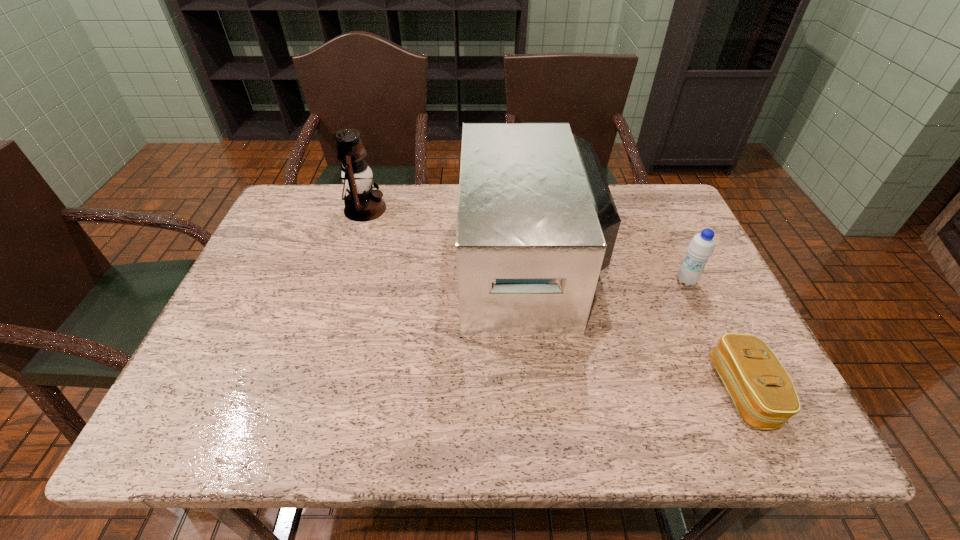
Where is `free space at the near edge of the desktop`? Image resolution: width=960 pixels, height=540 pixels. free space at the near edge of the desktop is located at coordinates (552, 415).

Where is `vacant region at the left edge of the desktop`? vacant region at the left edge of the desktop is located at coordinates click(274, 249).

This screenshot has height=540, width=960. I want to click on vacant space at the right edge, so point(690,314).

In the image, there is a desktop. At what (x,y) coordinates should I click in order to perform the action: click on vacant region at the far left corner. Please return your answer as a coordinate pair (x, y). Image resolution: width=960 pixels, height=540 pixels. Looking at the image, I should click on (325, 199).

Identify the location of vacant space at the near right corner. 790,442.

Where is `vacant region between the second object from left to right and the shortest object`? vacant region between the second object from left to right and the shortest object is located at coordinates (636, 328).

Where is `vacant area that lies between the third object from right to left and the nearest object`? vacant area that lies between the third object from right to left and the nearest object is located at coordinates (636, 328).

Identify the location of empty space that is in between the leftmost object and the third object from right to left. (447, 236).

The height and width of the screenshot is (540, 960). Identify the location of the third closest object to the lantern. (762, 391).

Locate an element on the screen. object that stands as the second closest to the water bottle is located at coordinates (762, 391).